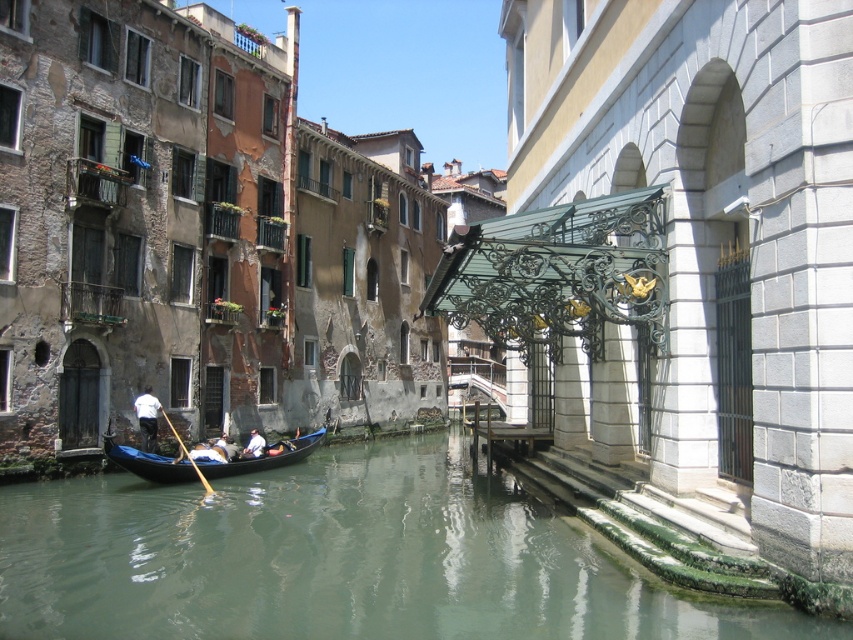
Question: Which of these objects is positioned farthest from the white matte shirt at center?

Choices:
 (A) greenish water at lower center
 (B) black polished wood gondola at center
 (C) white fabric shirt at lower center

Answer: (A)

Question: Which object is positioned farthest from the white matte shirt at center?

Choices:
 (A) white fabric shirt at lower center
 (B) greenish water at lower center
 (C) black polished wood gondola at center

Answer: (B)

Question: Is greenish water at lower center wider than white matte shirt at center?

Choices:
 (A) no
 (B) yes

Answer: (B)

Question: Which point is farther to the camera?

Choices:
 (A) greenish water at lower center
 (B) white fabric shirt at lower center
 (C) white matte shirt at center

Answer: (B)

Question: In this image, where is black polished wood gondola at center located relative to white fabric shirt at lower center?

Choices:
 (A) left
 (B) right

Answer: (B)

Question: Does greenish water at lower center have a smaller size compared to white matte shirt at center?

Choices:
 (A) yes
 (B) no

Answer: (B)